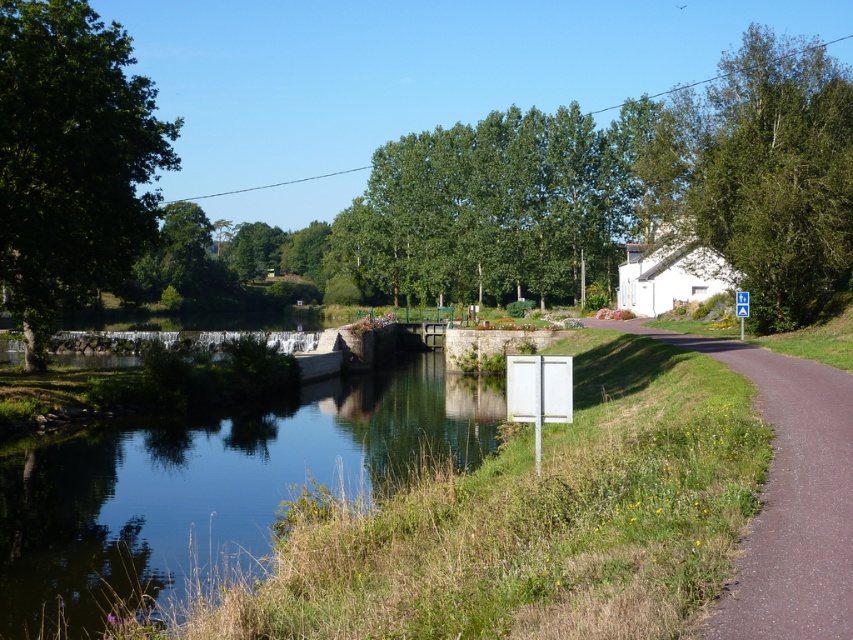
Between brown asphalt path at lower right and white plastic sign at center, which one has less height?

white plastic sign at center

Does brown asphalt path at lower right have a lesser height compared to white plastic sign at center?

In fact, brown asphalt path at lower right may be taller than white plastic sign at center.

The width and height of the screenshot is (853, 640). Identify the location of brown asphalt path at lower right. (787, 497).

Is clear water at center positioned in front of green leafy tree at upper right?

Yes, clear water at center is in front of green leafy tree at upper right.

How distant is clear water at center from green leafy tree at upper right?

A distance of 29.48 meters exists between clear water at center and green leafy tree at upper right.

Between point (254, 413) and point (721, 84), which one is positioned in front?

Point (254, 413) is more forward.

I want to click on clear water at center, so click(x=212, y=483).

Which is in front, point (749, 218) or point (840, 392)?

Point (840, 392)

Can you confirm if green leafy tree at upper right is positioned to the left of brown asphalt path at lower right?

No, green leafy tree at upper right is not to the left of brown asphalt path at lower right.

Is point (811, 102) farther from viewer compared to point (747, 604)?

Yes, point (811, 102) is farther from viewer.

The height and width of the screenshot is (640, 853). I want to click on green leafy tree at upper right, so click(x=761, y=173).